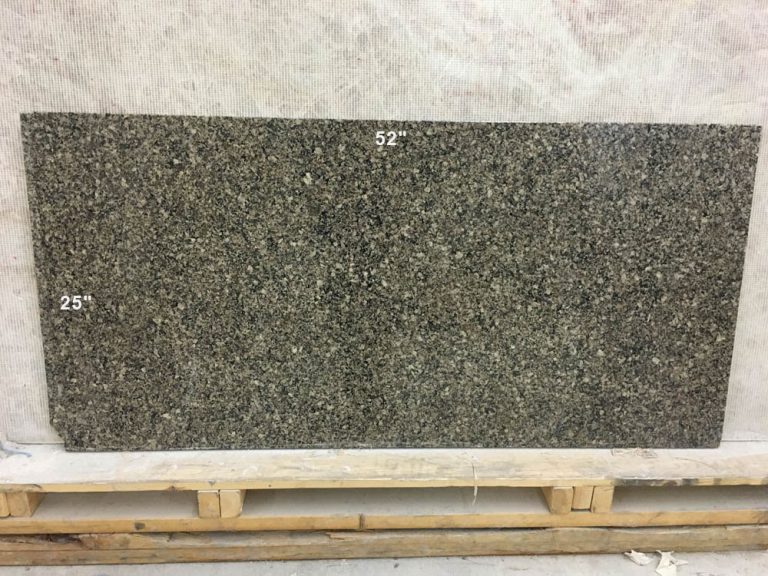
You are a GUI agent. You are given a task and a screenshot of the screen. Output one action in this format:
    pyautogui.click(x=<x>, y=<y>)
    Task: Click on the square corners
    This screenshot has height=576, width=768.
    Given the screenshot: What is the action you would take?
    pyautogui.click(x=714, y=438), pyautogui.click(x=752, y=131), pyautogui.click(x=30, y=118)